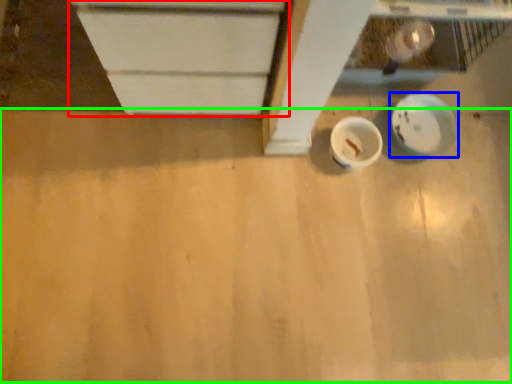
Question: Based on their relative distances, which object is farther from cabinetry (highlighted by a red box)? Choose from plate (highlighted by a blue box) and plywood (highlighted by a green box).

Choices:
 (A) plate
 (B) plywood

Answer: (A)